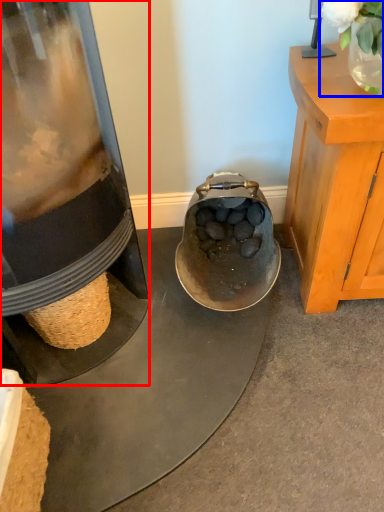
Question: Which object is closer to the camera taking this photo, appliance (highlighted by a red box) or plant (highlighted by a blue box)?

Choices:
 (A) appliance
 (B) plant

Answer: (A)